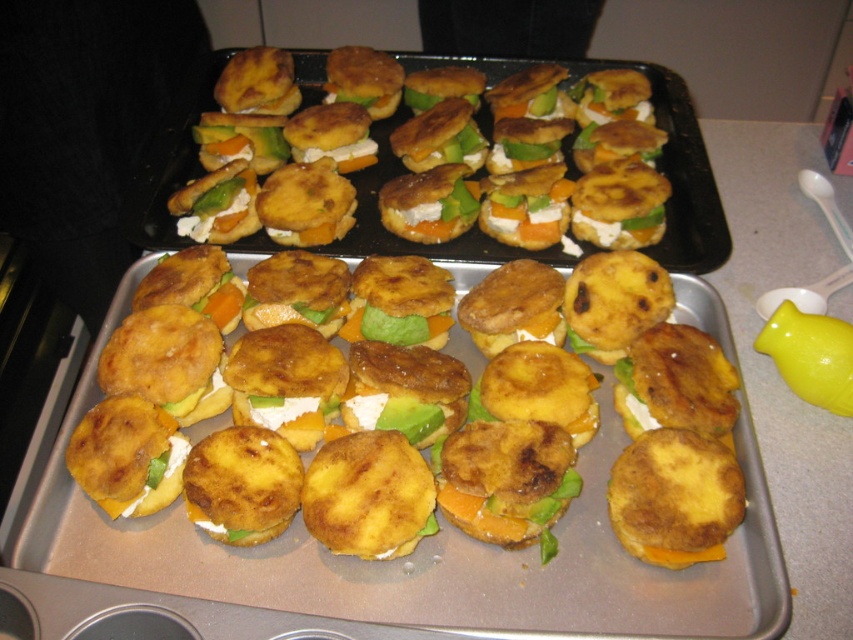
Question: Is golden-brown fried patty at center positioned before golden fried sandwich at center?

Choices:
 (A) no
 (B) yes

Answer: (B)

Question: Can you confirm if golden-brown fried patty at center is positioned to the left of golden fried sandwich at center?

Choices:
 (A) no
 (B) yes

Answer: (A)

Question: Which point appears closest to the camera in this image?

Choices:
 (A) (706, 358)
 (B) (454, 163)

Answer: (A)

Question: Among these objects, which one is nearest to the camera?

Choices:
 (A) golden fried sandwich at center
 (B) golden-brown fried patty at center

Answer: (B)

Question: Is golden-brown fried patty at center further to camera compared to golden fried sandwich at center?

Choices:
 (A) no
 (B) yes

Answer: (A)